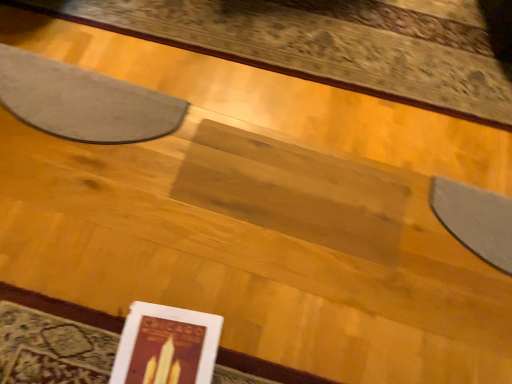
Find the location of a particular element. This screenshot has height=384, width=512. vacant area on top of gray felt mat at upper left (from a real-world perspective) is located at coordinates click(94, 106).